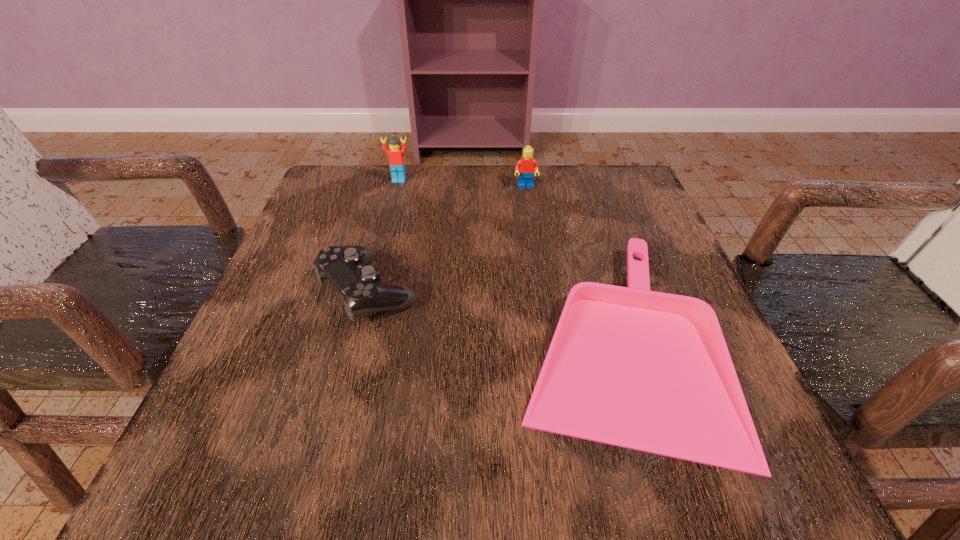
Identify the location of vacant space at the left edge. Image resolution: width=960 pixels, height=540 pixels. (313, 362).

Where is `vacant area at the right edge of the desktop`? The height and width of the screenshot is (540, 960). vacant area at the right edge of the desktop is located at coordinates (627, 235).

Locate an element on the screen. Image resolution: width=960 pixels, height=540 pixels. vacant space at the far left corner of the desktop is located at coordinates (359, 169).

At what (x,y) coordinates should I click in order to perform the action: click on free location at the near left corner of the desktop. Please return your answer as a coordinate pair (x, y). This screenshot has height=540, width=960. Looking at the image, I should click on (201, 469).

This screenshot has width=960, height=540. Find the location of `free location at the far right corner of the desktop`. free location at the far right corner of the desktop is located at coordinates pyautogui.click(x=626, y=188).

What are the coordinates of `free space at the near right corner of the desktop` in the screenshot? It's located at (715, 485).

At what (x,y) coordinates should I click in order to perform the action: click on vacant region between the control and the right Lego. Please return your answer as a coordinate pair (x, y). The width and height of the screenshot is (960, 540). Looking at the image, I should click on click(x=447, y=239).

Image resolution: width=960 pixels, height=540 pixels. What are the coordinates of `free spot between the shortest object and the second shortest object` in the screenshot? It's located at (491, 316).

Find the location of a particular element. empty location between the farthest object and the second shortest object is located at coordinates (384, 235).

I want to click on free space between the control and the shortest object, so click(x=491, y=316).